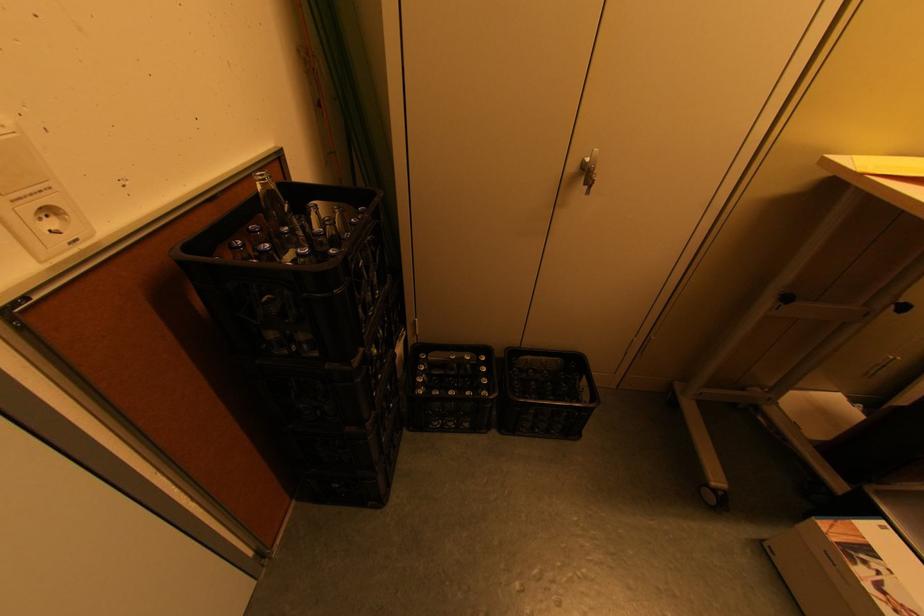
At what (x,y) coordinates should I click in order to perform the action: click on power socket. Please return your answer as a coordinate pair (x, y). Image resolution: width=924 pixels, height=616 pixels. Looking at the image, I should click on (39, 209).